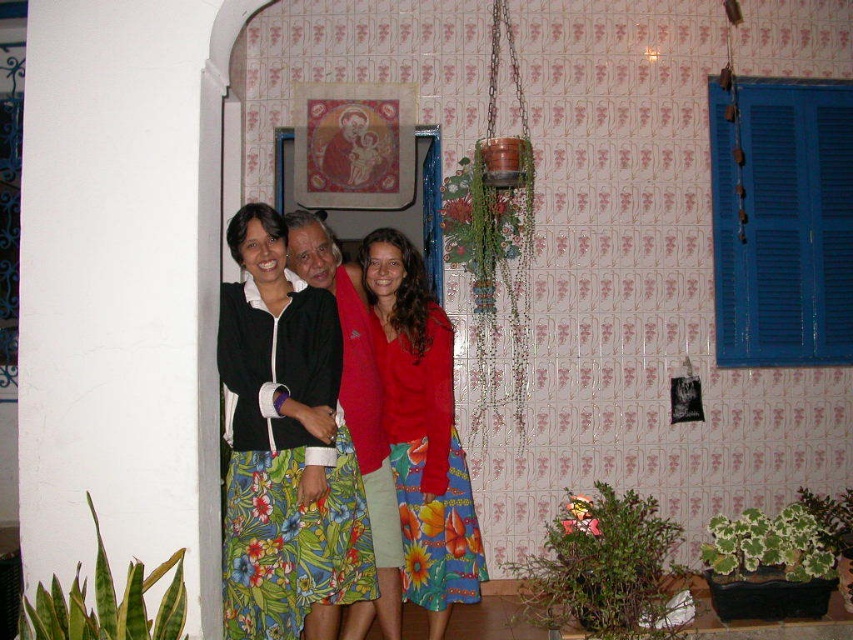
Question: Does floral fabric skirt at center appear over floral print fabric dress at center?

Choices:
 (A) yes
 (B) no

Answer: (A)

Question: Can you confirm if floral fabric skirt at center is positioned above blue wooden shutters at right?

Choices:
 (A) no
 (B) yes

Answer: (A)

Question: Among these objects, which one is nearest to the camera?

Choices:
 (A) floral print fabric dress at center
 (B) floral skirt at center
 (C) floral fabric skirt at center
 (D) matte black jacket at center

Answer: (C)

Question: Which point is closer to the camera?

Choices:
 (A) (424, 317)
 (B) (218, 337)
 (C) (834, 106)
 (D) (373, 381)

Answer: (B)

Question: Is floral print fabric dress at center closer to the viewer compared to matte black jacket at center?

Choices:
 (A) yes
 (B) no

Answer: (A)

Question: Which of the following is the closest to the observer?

Choices:
 (A) (369, 445)
 (B) (412, 570)
 (C) (247, 451)
 (D) (763, 160)

Answer: (C)